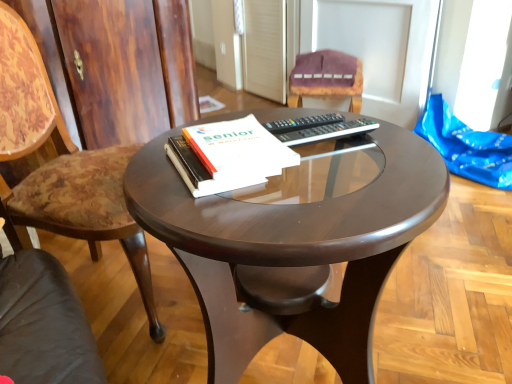
Identify the location of free space in front of white paper at center. The width and height of the screenshot is (512, 384). (239, 219).